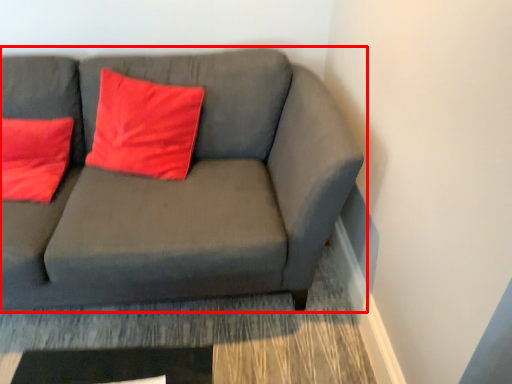
Question: Considering the relative positions of studio couch (annotated by the red box) and pillow in the image provided, where is studio couch (annotated by the red box) located with respect to the staircase?

Choices:
 (A) left
 (B) right

Answer: (A)